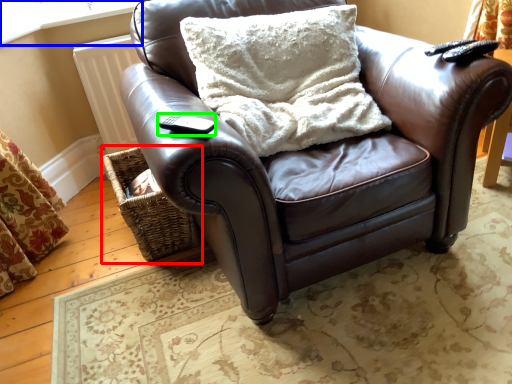
Question: Estimate the real-world distances between objects in this image. Which object is closer to basket (highlighted by a red box), window frame (highlighted by a blue box) or remote (highlighted by a green box)?

Choices:
 (A) window frame
 (B) remote

Answer: (B)